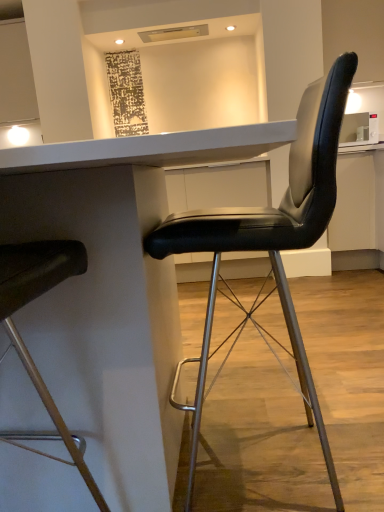
This screenshot has width=384, height=512. In order to click on free spot behind black leather chair at right, the first chair in the right-to-left sequence in this screenshot , I will do `click(292, 382)`.